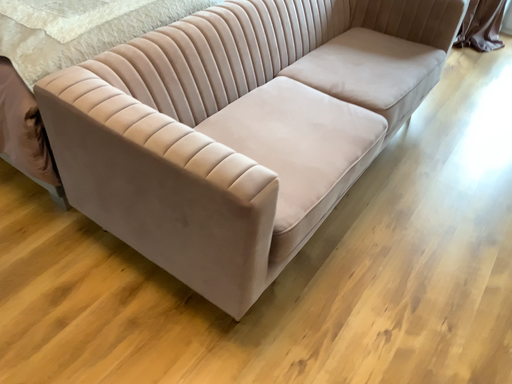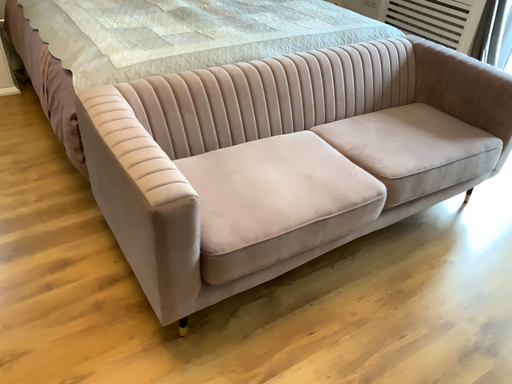
Question: How did the camera likely rotate when shooting the video?

Choices:
 (A) rotated right
 (B) rotated left

Answer: (B)